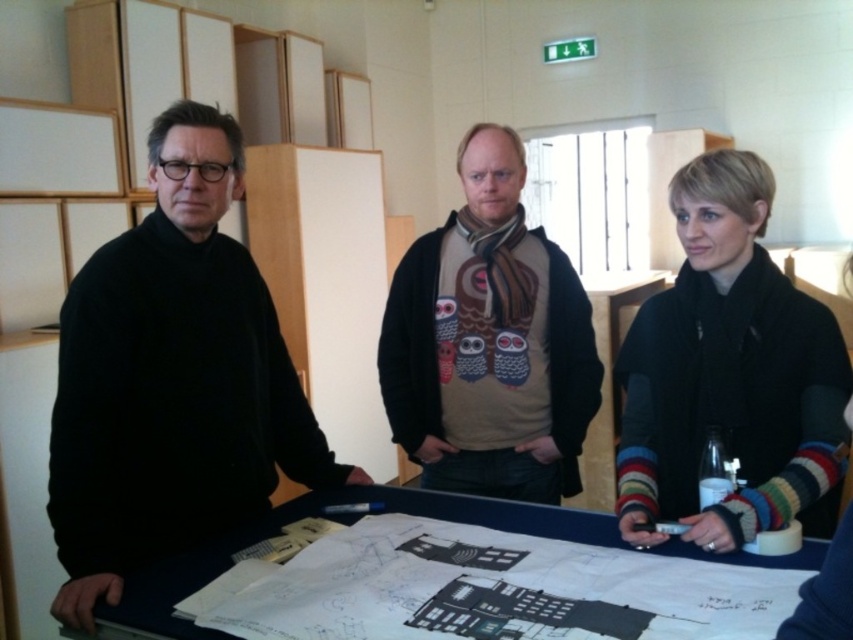
Which is above, black woolen scarf at center or olive green sweater at center?

olive green sweater at center is higher up.

What do you see at coordinates (730, 374) in the screenshot? Image resolution: width=853 pixels, height=640 pixels. I see `black woolen scarf at center` at bounding box center [730, 374].

Where is `black woolen scarf at center`? black woolen scarf at center is located at coordinates (730, 374).

Consider the image. Who is positioned more to the right, olive green sweater at center or blue fabric table at center?

olive green sweater at center is more to the right.

Does olive green sweater at center come behind blue fabric table at center?

Yes, it is.

Locate an element on the screen. This screenshot has width=853, height=640. olive green sweater at center is located at coordinates (490, 342).

Image resolution: width=853 pixels, height=640 pixels. Describe the element at coordinates (730, 374) in the screenshot. I see `black woolen scarf at center` at that location.

Is black woolen scarf at center in front of blue fabric table at center?

No, black woolen scarf at center is behind blue fabric table at center.

In order to click on black woolen scarf at center in this screenshot , I will do 730,374.

Where is `black woolen scarf at center`? black woolen scarf at center is located at coordinates (730, 374).